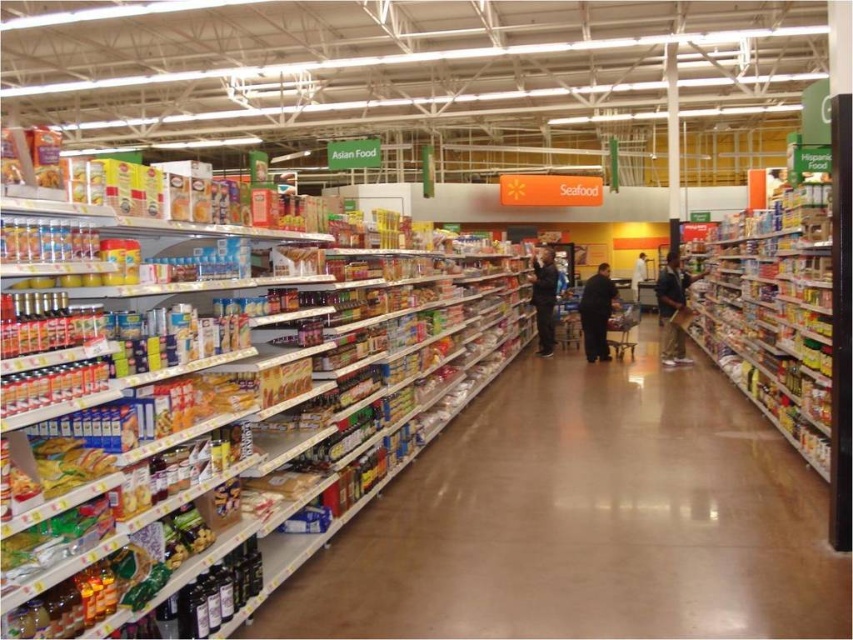
Which of these two, black matte jacket at center or white fabric person at center, stands taller?

white fabric person at center

Is black matte jacket at center positioned at the back of white fabric person at center?

No, it is not.

Which is in front, point (601, 308) or point (637, 252)?

Point (601, 308) is more forward.

Find the location of a particular element. black matte jacket at center is located at coordinates (x=596, y=312).

Can you confirm if matte plastic shelf at right is positioned above dark blue shirt at center?

Correct, matte plastic shelf at right is located above dark blue shirt at center.

Which is in front, point (808, 253) or point (656, 289)?

Point (808, 253) is in front.

This screenshot has height=640, width=853. What are the coordinates of `matte plastic shelf at right` in the screenshot? It's located at (775, 314).

Which is more to the right, dark blue jeans at center or white fabric person at center?

From the viewer's perspective, white fabric person at center appears more on the right side.

Can you confirm if dark blue jeans at center is shorter than white fabric person at center?

No.

Between point (550, 272) and point (631, 280), which one is positioned in front?

Point (550, 272) is more forward.

Locate an element on the screen. The image size is (853, 640). dark blue jeans at center is located at coordinates (544, 298).